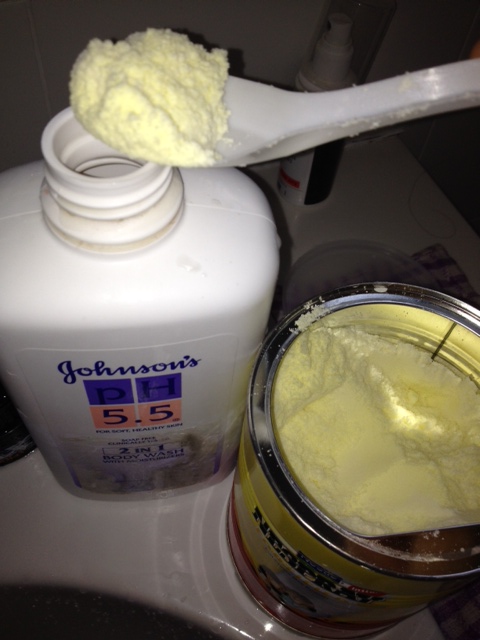
Identify the location of spoon. The image size is (480, 640). (302, 116).